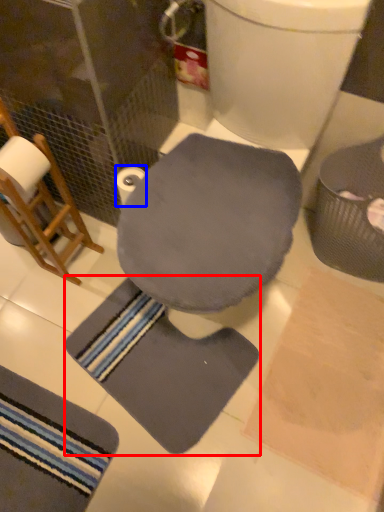
Question: Which object is closer to the camera taking this photo, bath mat (highlighted by a red box) or toilet paper (highlighted by a blue box)?

Choices:
 (A) bath mat
 (B) toilet paper

Answer: (B)